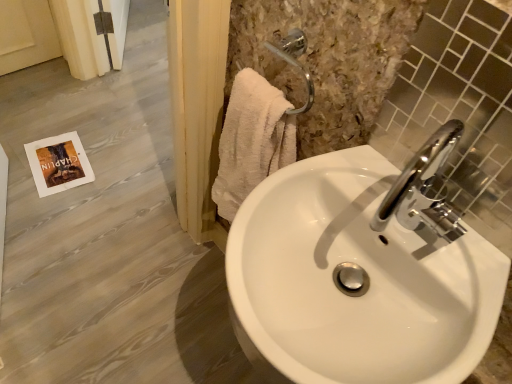
The height and width of the screenshot is (384, 512). In order to click on chrome metallic faucet at upper right in this screenshot , I will do `click(424, 189)`.

This screenshot has height=384, width=512. What are the coordinates of `white fluffy towel at upper right` in the screenshot? It's located at (252, 140).

From the image's perspective, would you say chrome metallic faucet at upper right is shown under white fluffy towel at upper right?

Yes, from the image's perspective, chrome metallic faucet at upper right is below white fluffy towel at upper right.

Does point (459, 191) appear closer or farther from the camera than point (231, 129)?

Point (459, 191) is positioned closer to the camera compared to point (231, 129).

In terms of size, does chrome metallic faucet at upper right appear bigger or smaller than white fluffy towel at upper right?

Considering their sizes, chrome metallic faucet at upper right takes up less space than white fluffy towel at upper right.

Is chrome metallic faucet at upper right oriented towards white fluffy towel at upper right?

No, chrome metallic faucet at upper right is not oriented towards white fluffy towel at upper right.

Based on their positions, is chrome metallic faucet at upper right located to the left or right of chrome metallic faucet at upper right?

In the image, chrome metallic faucet at upper right appears on the right side of chrome metallic faucet at upper right.

Is chrome metallic faucet at upper right positioned with its back to chrome metallic faucet at upper right?

chrome metallic faucet at upper right is not turned away from chrome metallic faucet at upper right.

Considering the sizes of objects chrome metallic faucet at upper right and chrome metallic faucet at upper right in the image provided, who is smaller, chrome metallic faucet at upper right or chrome metallic faucet at upper right?

chrome metallic faucet at upper right is smaller.

Looking at this image, considering the sizes of chrome metallic faucet at upper right and white fluffy towel at upper right in the image, is chrome metallic faucet at upper right taller or shorter than white fluffy towel at upper right?

Considering their sizes, chrome metallic faucet at upper right has less height than white fluffy towel at upper right.

Is chrome metallic faucet at upper right spatially inside white fluffy towel at upper right, or outside of it?

chrome metallic faucet at upper right exists outside the volume of white fluffy towel at upper right.

Based on the photo, how far apart are chrome metallic faucet at upper right and white fluffy towel at upper right?

The distance of chrome metallic faucet at upper right from white fluffy towel at upper right is 12.54 inches.

What's the angular difference between chrome metallic faucet at upper right and white fluffy towel at upper right's facing directions?

chrome metallic faucet at upper right and white fluffy towel at upper right are facing 4.61 degrees away from each other.

Which point is more distant from viewer, (x=364, y=271) or (x=241, y=153)?

Point (x=241, y=153)

Which of these two, white glossy sink at center or white fluffy towel at upper right, is smaller?

With smaller size is white fluffy towel at upper right.

Considering the relative positions of white glossy sink at center and white fluffy towel at upper right in the image provided, is white glossy sink at center in front of white fluffy towel at upper right?

Yes, white glossy sink at center is closer to the camera.

Is white glossy sink at center taller or shorter than white fluffy towel at upper right?

white glossy sink at center is shorter than white fluffy towel at upper right.

From a real-world perspective, is chrome metallic faucet at upper right positioned under chrome metallic faucet at upper right based on gravity?

Yes, from a real-world perspective, chrome metallic faucet at upper right is below chrome metallic faucet at upper right.

Is chrome metallic faucet at upper right placed right next to chrome metallic faucet at upper right?

Yes, chrome metallic faucet at upper right and chrome metallic faucet at upper right clearly make contact.

At what (x,y) coordinates should I click in order to perform the action: click on tap below the chrome metallic faucet at upper right (from a real-world perspective). Please return your answer as a coordinate pair (x, y). Looking at the image, I should click on (424, 189).

Is chrome metallic faucet at upper right facing towards chrome metallic faucet at upper right?

No, chrome metallic faucet at upper right does not turn towards chrome metallic faucet at upper right.

Is point (394, 301) closer or farther from the camera than point (504, 122)?

Point (394, 301) is positioned farther from the camera compared to point (504, 122).

Choose the correct answer: Is white glossy sink at center inside chrome metallic faucet at upper right or outside it?

white glossy sink at center is not inside chrome metallic faucet at upper right, it's outside.

From a real-world perspective, is white glossy sink at center positioned under chrome metallic faucet at upper right based on gravity?

Correct, in the physical world, white glossy sink at center is lower than chrome metallic faucet at upper right.

Does white glossy sink at center have a larger size compared to chrome metallic faucet at upper right?

Yes, white glossy sink at center is bigger than chrome metallic faucet at upper right.

Is white fluffy towel at upper right spatially inside white glossy sink at center, or outside of it?

The correct answer is: outside.

Considering the positions of objects white fluffy towel at upper right and white glossy sink at center in the image provided, who is more to the right, white fluffy towel at upper right or white glossy sink at center?

white glossy sink at center is more to the right.

From a real-world perspective, which object stands above the other?

From a 3D spatial view, white glossy sink at center is above.

At what (x,y) coordinates should I click in order to perform the action: click on bath towel that is above the chrome metallic faucet at upper right (from the image's perspective). Please return your answer as a coordinate pair (x, y). The image size is (512, 384). Looking at the image, I should click on (252, 140).

Find the location of a particular element. This screenshot has width=512, height=384. tap below the chrome metallic faucet at upper right (from a real-world perspective) is located at coordinates (424, 189).

Considering their positions, is white glossy sink at center positioned further to white fluffy towel at upper right than chrome metallic faucet at upper right?

Among the two, chrome metallic faucet at upper right is located further to white fluffy towel at upper right.

Which object lies nearer to the anchor point chrome metallic faucet at upper right, chrome metallic faucet at upper right or white glossy sink at center?

Among the two, chrome metallic faucet at upper right is located nearer to chrome metallic faucet at upper right.

When comparing their distances from chrome metallic faucet at upper right, does white glossy sink at center or white fluffy towel at upper right seem further?

white fluffy towel at upper right is positioned further to the anchor chrome metallic faucet at upper right.

Consider the image. When comparing their distances from white glossy sink at center, does chrome metallic faucet at upper right or white fluffy towel at upper right seem closer?

Among the two, chrome metallic faucet at upper right is located nearer to white glossy sink at center.

Which object lies further to the anchor point chrome metallic faucet at upper right, white glossy sink at center or white fluffy towel at upper right?

The object further to chrome metallic faucet at upper right is white fluffy towel at upper right.

Looking at the image, which one is located further to white glossy sink at center, white fluffy towel at upper right or chrome metallic faucet at upper right?

white fluffy towel at upper right lies further to white glossy sink at center than the other object.

Looking at the image, which one is located closer to chrome metallic faucet at upper right, white fluffy towel at upper right or chrome metallic faucet at upper right?

chrome metallic faucet at upper right lies closer to chrome metallic faucet at upper right than the other object.

From the image, which object appears to be farther from chrome metallic faucet at upper right, chrome metallic faucet at upper right or white fluffy towel at upper right?

white fluffy towel at upper right is further to chrome metallic faucet at upper right.

Locate an element on the screen. Image resolution: width=512 pixels, height=384 pixels. tap between chrome metallic faucet at upper right and white fluffy towel at upper right along the z-axis is located at coordinates coord(424,189).

At what (x,y) coordinates should I click in order to perform the action: click on tap between chrome metallic faucet at upper right and white glossy sink at center vertically. Please return your answer as a coordinate pair (x, y). Image resolution: width=512 pixels, height=384 pixels. Looking at the image, I should click on (424, 189).

What are the coordinates of `tap between white glossy sink at center and white fluffy towel at upper right in the front-back direction` in the screenshot? It's located at (424, 189).

At what (x,y) coordinates should I click in order to perform the action: click on sink between chrome metallic faucet at upper right and white fluffy towel at upper right in the front-back direction. Please return your answer as a coordinate pair (x, y). Looking at the image, I should click on (362, 273).